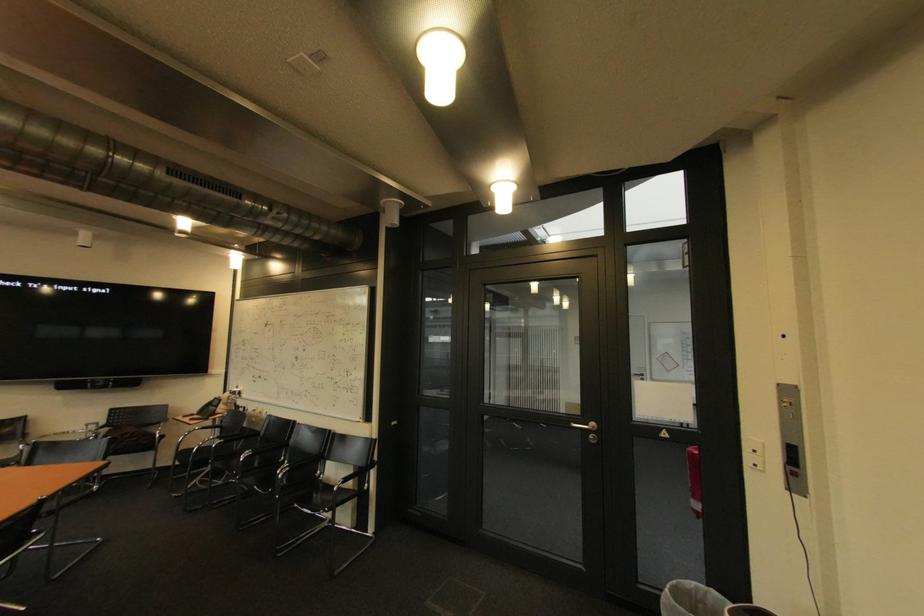
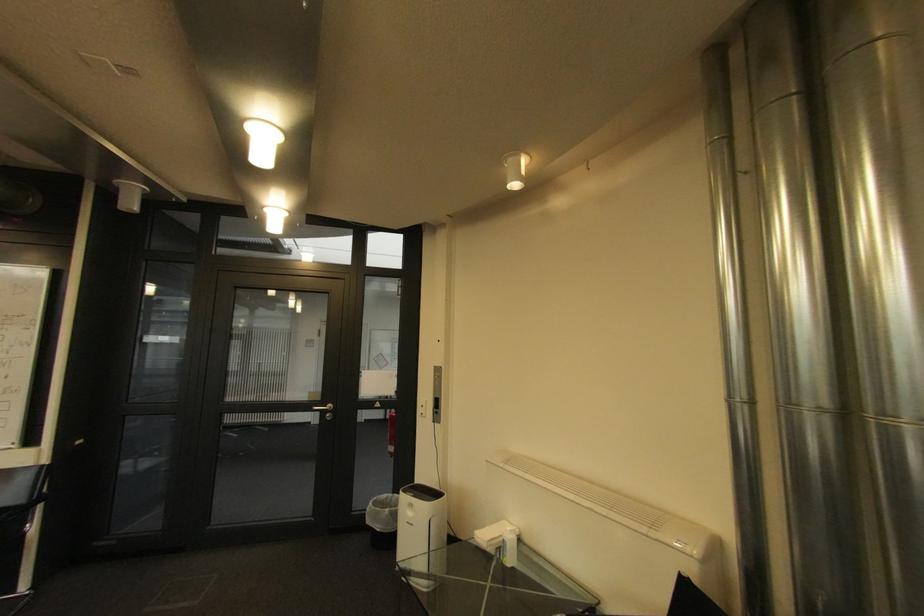
Question: The camera is either moving clockwise (left) or counter-clockwise (right) around the object. The first image is from the beginning of the video and the second image is from the end. Is the camera moving left or right when shooting the video?

Choices:
 (A) Left
 (B) Right

Answer: (A)